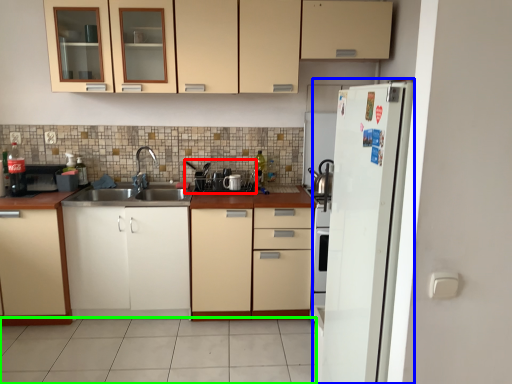
Question: Based on their relative distances, which object is nearer to appliance (highlighted by a red box)? Choose from refrigerator (highlighted by a blue box) and tile (highlighted by a green box).

Choices:
 (A) refrigerator
 (B) tile

Answer: (B)